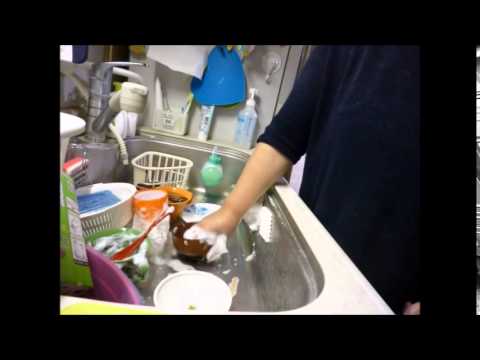
This screenshot has width=480, height=360. In order to click on basket in this screenshot , I will do `click(140, 167)`.